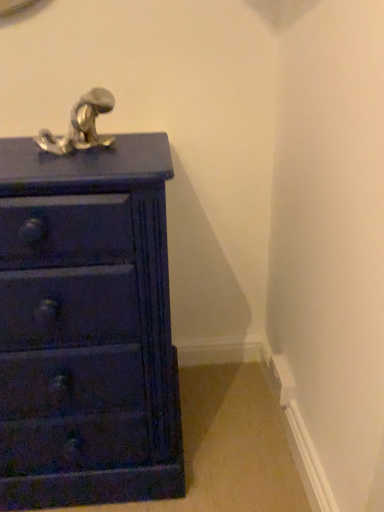
Question: From a real-world perspective, relative to satin nickel faucet at upper left, is matte dark blue chest of drawers at left vertically above or below?

Choices:
 (A) above
 (B) below

Answer: (B)

Question: Is point (102, 310) closer or farther from the camera than point (79, 133)?

Choices:
 (A) farther
 (B) closer

Answer: (B)

Question: From the image's perspective, is matte dark blue chest of drawers at left located above or below satin nickel faucet at upper left?

Choices:
 (A) above
 (B) below

Answer: (B)

Question: Is satin nickel faucet at upper left situated inside matte dark blue chest of drawers at left or outside?

Choices:
 (A) outside
 (B) inside

Answer: (A)

Question: Is point (87, 111) positioned closer to the camera than point (130, 472)?

Choices:
 (A) closer
 (B) farther

Answer: (A)

Question: Looking at the image, does satin nickel faucet at upper left seem bigger or smaller compared to matte dark blue chest of drawers at left?

Choices:
 (A) big
 (B) small

Answer: (B)

Question: Is satin nickel faucet at upper left wider or thinner than matte dark blue chest of drawers at left?

Choices:
 (A) wide
 (B) thin

Answer: (B)